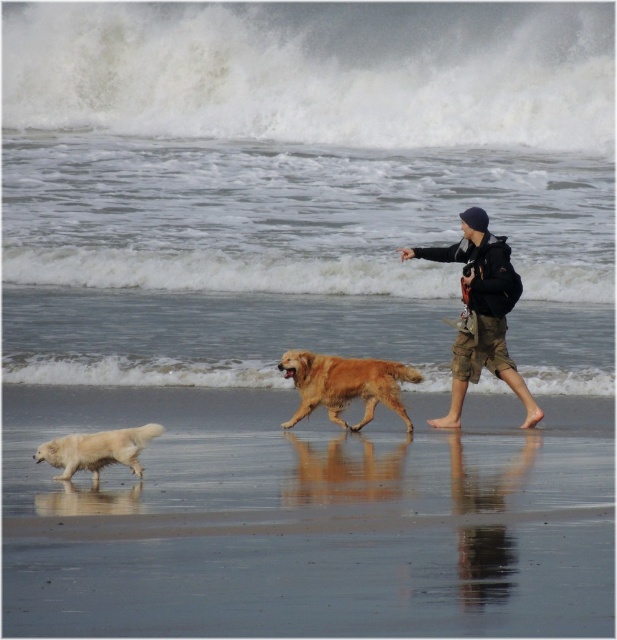
Question: Which point appears farthest from the camera in this image?

Choices:
 (A) (486, 298)
 (B) (101, 440)
 (C) (329, 396)

Answer: (A)

Question: Is white fur dog at lower left smaller than dark blue knit cap at upper right?

Choices:
 (A) yes
 (B) no

Answer: (B)

Question: Which object appears farthest from the camera in this image?

Choices:
 (A) white fur dog at lower left
 (B) white fluffy dog at lower left
 (C) dark blue knit cap at upper right

Answer: (C)

Question: Can you confirm if golden fur dog at center is wider than white fluffy dog at lower left?

Choices:
 (A) yes
 (B) no

Answer: (A)

Question: Which of the following is the farthest from the observer?

Choices:
 (A) golden fur dog at center
 (B) white fur dog at lower left

Answer: (A)

Question: Where is dark blue knit cap at upper right located in relation to white fluffy dog at lower left in the image?

Choices:
 (A) left
 (B) right

Answer: (B)